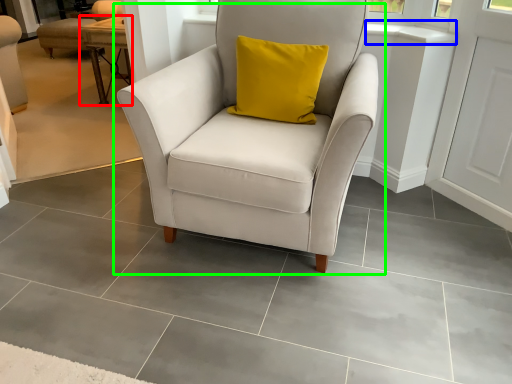
Question: Based on their relative distances, which object is farther from table (highlighted by a red box)? Choose from window sill (highlighted by a blue box) and chair (highlighted by a green box).

Choices:
 (A) window sill
 (B) chair

Answer: (A)